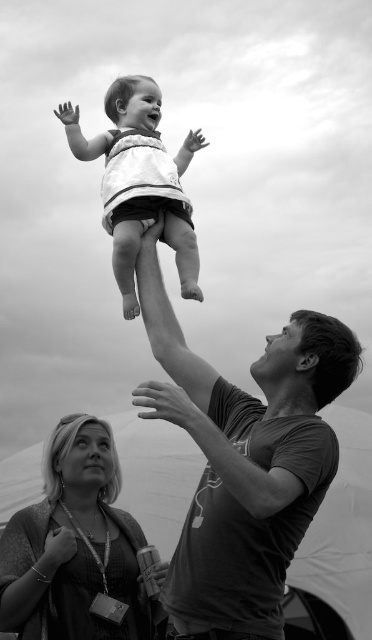
Question: Which point appears closest to the camera in this image?

Choices:
 (A) (245, 406)
 (B) (117, 202)

Answer: (A)

Question: Among these objects, which one is nearest to the camera?

Choices:
 (A) smooth dark gray shirt at upper center
 (B) matte black dress at lower left
 (C) white fabric baby at center

Answer: (A)

Question: Does matte black dress at lower left lie in front of white fabric baby at center?

Choices:
 (A) yes
 (B) no

Answer: (A)

Question: Can you confirm if matte black dress at lower left is positioned above white fabric baby at center?

Choices:
 (A) no
 (B) yes

Answer: (A)

Question: Can you confirm if smooth dark gray shirt at upper center is bigger than white fabric baby at center?

Choices:
 (A) no
 (B) yes

Answer: (B)

Question: Which point is closer to the camera?

Choices:
 (A) matte black dress at lower left
 (B) smooth dark gray shirt at upper center
 (C) white fabric baby at center

Answer: (B)